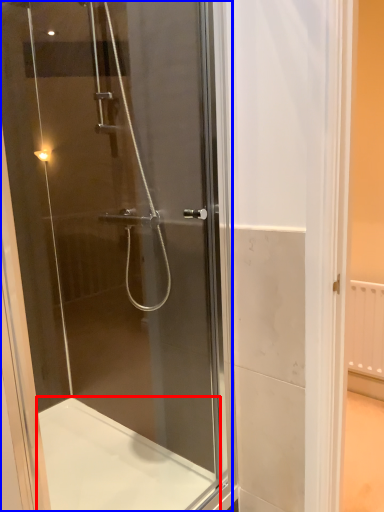
Question: Among these objects, which one is nearest to the camera, bath (highlighted by a red box) or screen door (highlighted by a blue box)?

Choices:
 (A) bath
 (B) screen door

Answer: (B)